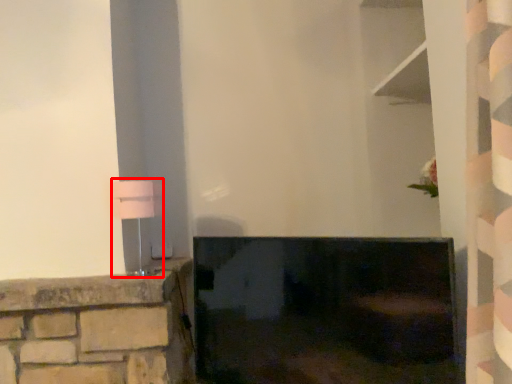
Question: Considering the relative positions of table lamp (annotated by the red box) and fireplace in the image provided, where is table lamp (annotated by the red box) located with respect to the staircase?

Choices:
 (A) right
 (B) left

Answer: (B)